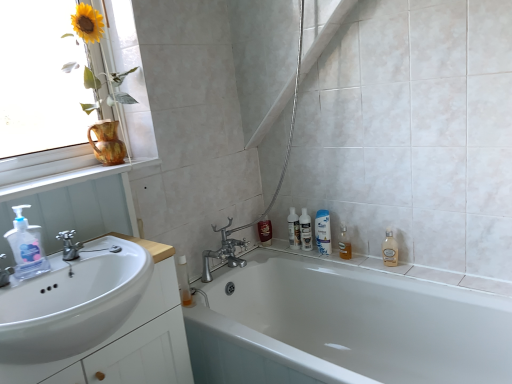
You are a GUI agent. You are given a task and a screenshot of the screen. Output one action in this format:
    pyautogui.click(x=<x>, y=<y>)
    Task: Click on the vacant space situated above white wood window sill at upper left (from a real-world perspective)
    
    Given the screenshot: What is the action you would take?
    pyautogui.click(x=55, y=175)